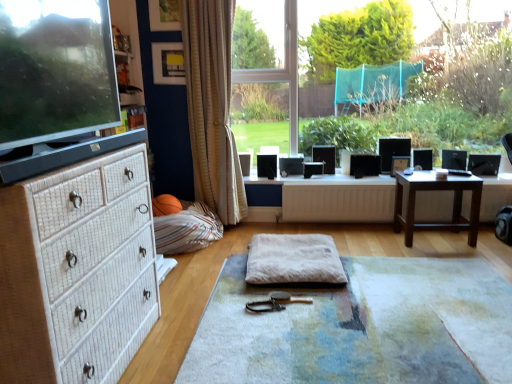
Question: Is striped fabric bean bag at lower left outside white wicker chest of drawers at left?

Choices:
 (A) no
 (B) yes

Answer: (B)

Question: Can you confirm if striped fabric bean bag at lower left is thinner than white wicker chest of drawers at left?

Choices:
 (A) yes
 (B) no

Answer: (B)

Question: Could white wicker chest of drawers at left be considered to be inside striped fabric bean bag at lower left?

Choices:
 (A) yes
 (B) no

Answer: (B)

Question: From the image's perspective, is striped fabric bean bag at lower left located beneath white wicker chest of drawers at left?

Choices:
 (A) yes
 (B) no

Answer: (B)

Question: Does striped fabric bean bag at lower left turn towards white wicker chest of drawers at left?

Choices:
 (A) yes
 (B) no

Answer: (B)

Question: From a real-world perspective, is striped fabric bean bag at lower left physically above white wicker chest of drawers at left?

Choices:
 (A) no
 (B) yes

Answer: (A)

Question: From the image's perspective, does striped fabric bean bag at lower left appear higher than matte wooden picture frame at upper center?

Choices:
 (A) yes
 (B) no

Answer: (B)

Question: Is striped fabric bean bag at lower left outside of matte wooden picture frame at upper center?

Choices:
 (A) yes
 (B) no

Answer: (A)

Question: Can you confirm if striped fabric bean bag at lower left is taller than matte wooden picture frame at upper center?

Choices:
 (A) yes
 (B) no

Answer: (B)

Question: Is striped fabric bean bag at lower left positioned far away from matte wooden picture frame at upper center?

Choices:
 (A) no
 (B) yes

Answer: (B)

Question: Is striped fabric bean bag at lower left bigger than matte wooden picture frame at upper center?

Choices:
 (A) yes
 (B) no

Answer: (A)

Question: Does striped fabric bean bag at lower left have a greater width compared to matte wooden picture frame at upper center?

Choices:
 (A) yes
 (B) no

Answer: (A)

Question: Is beige striped curtain at center inside matte black monitor at left?

Choices:
 (A) yes
 (B) no

Answer: (B)